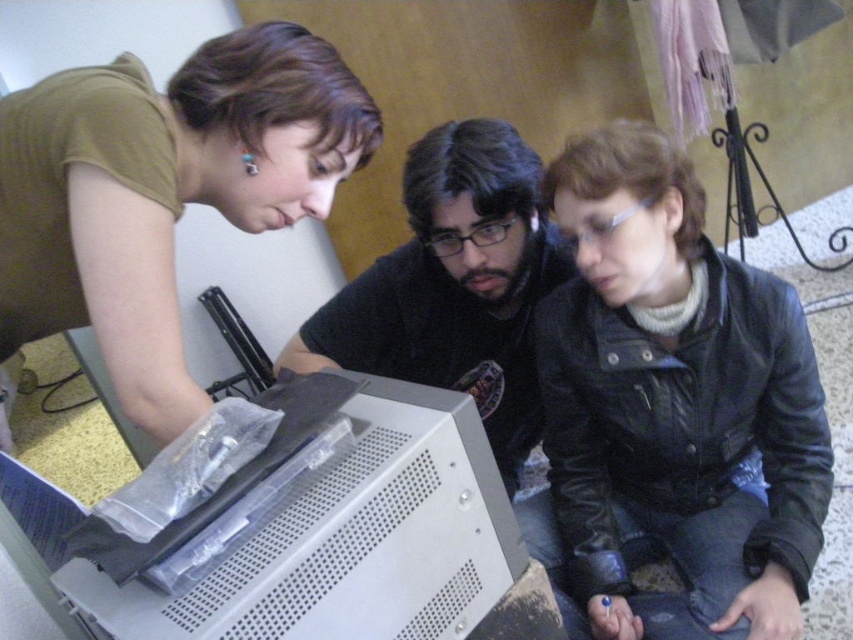
Which is below, black leather jacket at lower right or matte green shirt at upper left?

Positioned lower is black leather jacket at lower right.

Is point (764, 605) behind point (202, 396)?

Yes, it is behind point (202, 396).

Between point (630, 180) and point (286, 148), which one is positioned in front?

Positioned in front is point (286, 148).

Where is `black leather jacket at lower right`? This screenshot has width=853, height=640. black leather jacket at lower right is located at coordinates (670, 410).

Does black leather jacket at lower right appear over matte black shirt at center?

Incorrect, black leather jacket at lower right is not positioned above matte black shirt at center.

Can you confirm if black leather jacket at lower right is shorter than matte black shirt at center?

No.

Does point (589, 637) lie in front of point (502, 433)?

Yes, point (589, 637) is closer to viewer.

The height and width of the screenshot is (640, 853). I want to click on black leather jacket at lower right, so click(670, 410).

Can you confirm if matte green shirt at upper left is shorter than matte black shirt at center?

Indeed, matte green shirt at upper left has a lesser height compared to matte black shirt at center.

Which is in front, point (27, 208) or point (517, 442)?

Positioned in front is point (27, 208).

Where is `matte green shirt at upper left`? The height and width of the screenshot is (640, 853). matte green shirt at upper left is located at coordinates (161, 192).